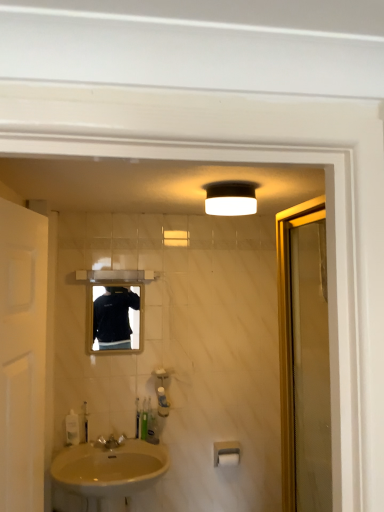
What is the approximate width of white matte light fixture at upper center?

The width of white matte light fixture at upper center is 8.73 inches.

What is the approximate width of beige porcelain sink at lower left?

beige porcelain sink at lower left is 20.24 inches in width.

This screenshot has width=384, height=512. What do you see at coordinates (162, 402) in the screenshot? I see `translucent plastic toothbrush at lower center, which is counted as the first toiletry, starting from the right` at bounding box center [162, 402].

Identify the location of white matte toilet paper at lower center. This screenshot has width=384, height=512. (228, 458).

In the scene shown: In terms of width, does silver metallic faucet at lower center look wider or thinner when compared to translucent plastic soap dispenser at lower left?

silver metallic faucet at lower center is wider than translucent plastic soap dispenser at lower left.

From the image's perspective, which one is positioned higher, silver metallic faucet at lower center or translucent plastic soap dispenser at lower left?

translucent plastic soap dispenser at lower left.

Does silver metallic faucet at lower center come in front of translucent plastic soap dispenser at lower left?

Yes, silver metallic faucet at lower center is in front of translucent plastic soap dispenser at lower left.

From a real-world perspective, is silver metallic faucet at lower center above or below translucent plastic soap dispenser at lower left?

Clearly, from a real-world perspective, silver metallic faucet at lower center is below translucent plastic soap dispenser at lower left.

Would you say silver metallic faucet at lower center is part of beige porcelain sink at lower left's contents?

No.

At what (x,y) coordinates should I click in order to perform the action: click on sink below the silver metallic faucet at lower center (from the image's perspective). Please return your answer as a coordinate pair (x, y). Looking at the image, I should click on (105, 474).

Does point (66, 510) lie in front of point (96, 440)?

Yes.

Which object is closer to the camera taking this photo, beige porcelain sink at lower left or silver metallic faucet at lower center?

Positioned in front is beige porcelain sink at lower left.

Between point (209, 188) and point (223, 457), which one is positioned behind?

Positioned behind is point (223, 457).

Who is smaller, white matte light fixture at upper center or white matte toilet paper at lower center?

Smaller between the two is white matte toilet paper at lower center.

From a real-world perspective, is white matte light fixture at upper center physically located above or below white matte toilet paper at lower center?

white matte light fixture at upper center is situated higher than white matte toilet paper at lower center in the real world.

In the scene shown: Is green plastic toothbrush at lower center, which ranks as the fourth toiletry in left-to-right order, to the left of white matte toilet paper at lower center from the viewer's perspective?

Correct, you'll find green plastic toothbrush at lower center, which ranks as the fourth toiletry in left-to-right order, to the left of white matte toilet paper at lower center.

From a real-world perspective, which is physically below, green plastic toothbrush at lower center, the second toiletry viewed from the right, or white matte toilet paper at lower center?

From a 3D spatial view, white matte toilet paper at lower center is below.

Are translucent plastic toothbrush at lower center, which is counted as the first toiletry, starting from the right, and white matte door at left making contact?

translucent plastic toothbrush at lower center, which is counted as the first toiletry, starting from the right, and white matte door at left are not in contact.

Considering the points (166, 403) and (6, 408), which point is behind, point (166, 403) or point (6, 408)?

The point (166, 403) is farther.

From the picture: Which is more to the left, translucent plastic toothbrush at lower center, which is counted as the first toiletry, starting from the right, or white matte door at left?

Positioned to the left is white matte door at left.

Is translucent plastic toothbrush at lower center, which is counted as the first toiletry, starting from the right, facing away from white matte door at left?

No.

Does point (99, 336) come in front of point (137, 403)?

Yes, point (99, 336) is closer to viewer.

Can we say black matte mirror at center lies outside green plastic toothbrush at lower center, which is the fourth toiletry from right to left?

Absolutely, black matte mirror at center is external to green plastic toothbrush at lower center, which is the fourth toiletry from right to left.

Starting from the black matte mirror at center, which toiletry is the 1st one to the right? Please provide its 2D coordinates.

[(137, 419)]

Could you tell me if black matte mirror at center is facing green plastic toothbrush at lower center, which is the fourth toiletry from right to left?

No.

Is clear plastic bottle at lower left, which ranks as the fifth toiletry in right-to-left order, in contact with white matte toilet paper at lower center?

No, clear plastic bottle at lower left, which ranks as the fifth toiletry in right-to-left order, is not next to white matte toilet paper at lower center.

Is clear plastic bottle at lower left, which ranks as the fifth toiletry in right-to-left order, in front of or behind white matte toilet paper at lower center in the image?

Visually, clear plastic bottle at lower left, which ranks as the fifth toiletry in right-to-left order, is located in front of white matte toilet paper at lower center.

From the picture: Is clear plastic bottle at lower left, the 1th toiletry when ordered from left to right, positioned with its back to white matte toilet paper at lower center?

No, white matte toilet paper at lower center is not at the back of clear plastic bottle at lower left, the 1th toiletry when ordered from left to right.

From the image's perspective, who appears lower, clear plastic bottle at lower left, the 1th toiletry when ordered from left to right, or white matte toilet paper at lower center?

white matte toilet paper at lower center appears lower in the image.

This screenshot has width=384, height=512. In order to click on soap dispenser that appears above the silver metallic faucet at lower center (from a real-world perspective) in this screenshot , I will do `click(84, 423)`.

At what (x,y) coordinates should I click in order to perform the action: click on tap behind the beige porcelain sink at lower left. Please return your answer as a coordinate pair (x, y). This screenshot has height=512, width=384. Looking at the image, I should click on (110, 441).

When comparing their distances from white matte toilet paper at lower center, does white matte light fixture at upper center or white matte door at left seem further?

white matte door at left.

In the scene shown: Which object lies further to the anchor point green plastic toothbrush at lower center, which ranks as the second toiletry in left-to-right order, silver metallic faucet at lower center or white matte towel bar at lower center?

The object further to green plastic toothbrush at lower center, which ranks as the second toiletry in left-to-right order, is white matte towel bar at lower center.

Considering their positions, is white matte towel bar at lower center positioned closer to green plastic toothbrush at lower center, the second toiletry viewed from the right, than clear plastic bottle at lower left, which ranks as the fifth toiletry in right-to-left order?

white matte towel bar at lower center.

Considering their positions, is black matte mirror at center positioned closer to clear plastic bottle at lower left, the 1th toiletry when ordered from left to right, than white matte light fixture at upper center?

black matte mirror at center.

Based on their spatial positions, is green plastic toothbrush at lower center, which is the fourth toiletry from right to left, or white matte toilet paper at lower center closer to black matte mirror at center?

green plastic toothbrush at lower center, which is the fourth toiletry from right to left, lies closer to black matte mirror at center than the other object.

Estimate the real-world distances between objects in this image. Which object is further from translucent plastic soap dispenser at lower left, translucent plastic soap dispenser at lower center, which ranks as the third toiletry in right-to-left order, or translucent plastic toothbrush at lower center, which is counted as the first toiletry, starting from the right?

translucent plastic toothbrush at lower center, which is counted as the first toiletry, starting from the right, lies further to translucent plastic soap dispenser at lower left than the other object.

From the image, which object appears to be nearer to black matte mirror at center, green plastic toothbrush at lower center, which ranks as the fourth toiletry in left-to-right order, or white matte towel bar at lower center?

green plastic toothbrush at lower center, which ranks as the fourth toiletry in left-to-right order, lies closer to black matte mirror at center than the other object.

Looking at the image, which one is located further to translucent plastic toothbrush at lower center, which is counted as the first toiletry, starting from the right, beige porcelain sink at lower left or white matte towel bar at lower center?

beige porcelain sink at lower left lies further to translucent plastic toothbrush at lower center, which is counted as the first toiletry, starting from the right, than the other object.

This screenshot has width=384, height=512. What are the coordinates of `towel bar between white matte door at left and translucent plastic soap dispenser at lower center, the 3th toiletry viewed from the left, along the z-axis` in the screenshot? It's located at (226, 453).

Locate an element on the screen. This screenshot has width=384, height=512. door between white matte light fixture at upper center and beige porcelain sink at lower left vertically is located at coordinates (22, 356).

At what (x,y) coordinates should I click in order to perform the action: click on towel bar between black matte mirror at center and beige porcelain sink at lower left from top to bottom. Please return your answer as a coordinate pair (x, y). The image size is (384, 512). Looking at the image, I should click on (226, 453).

Locate an element on the screen. This screenshot has height=512, width=384. soap dispenser between clear plastic bottle at lower left, which ranks as the fifth toiletry in right-to-left order, and green plastic toothbrush at lower center, which ranks as the fourth toiletry in left-to-right order, in the horizontal direction is located at coordinates (84, 423).